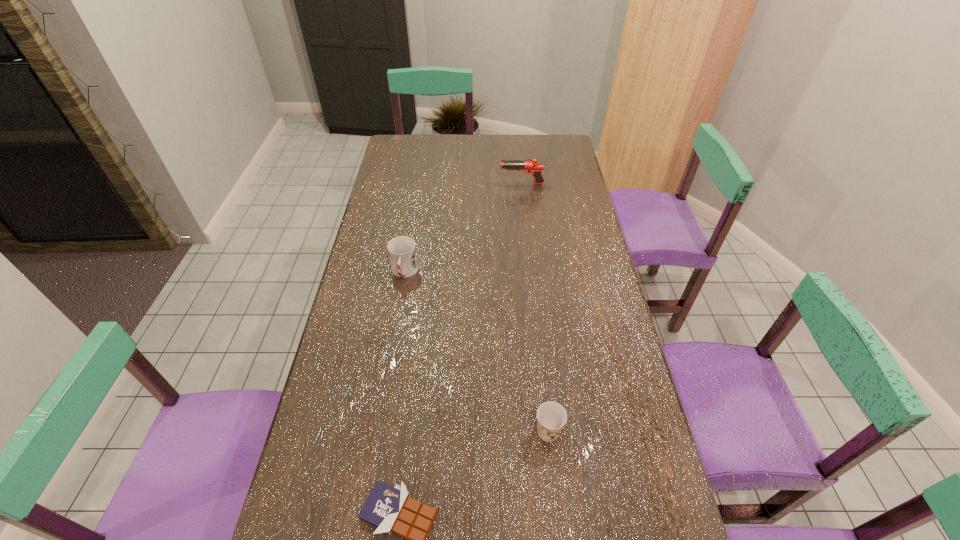
This screenshot has height=540, width=960. Find the location of `the farthest object`. the farthest object is located at coordinates (535, 168).

Where is `cup`? The image size is (960, 540). cup is located at coordinates (402, 251).

This screenshot has width=960, height=540. Find the location of `Dixie cup`. Dixie cup is located at coordinates (551, 417).

Where is `the third tallest object`? the third tallest object is located at coordinates (551, 417).

This screenshot has width=960, height=540. What are the coordinates of `vacant space situated at the aiming end of the gun` in the screenshot? It's located at (483, 184).

Identify the location of vacant space located at the aiming end of the gun. (456, 184).

At what (x,y) coordinates should I click in order to perform the action: click on vacant area situated 0.240m at the aiming end of the gun. Please return your answer as a coordinate pair (x, y). Looking at the image, I should click on (442, 184).

Where is `vacant space located 0.220m on the handle side of the cup`? This screenshot has height=540, width=960. vacant space located 0.220m on the handle side of the cup is located at coordinates (393, 342).

Find the location of a particular element. The width and height of the screenshot is (960, 540). blank area located 0.240m on the left of the Dixie cup is located at coordinates (437, 431).

Where is `object positioned at the left edge`? The width and height of the screenshot is (960, 540). object positioned at the left edge is located at coordinates (402, 251).